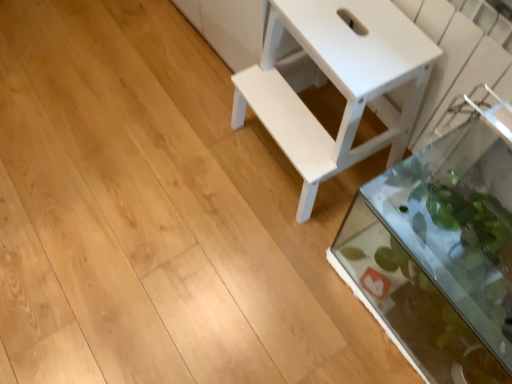
What are the coordinates of `transparent glass tank at lower right` in the screenshot? It's located at (438, 255).

The image size is (512, 384). What do you see at coordinates (438, 255) in the screenshot? I see `transparent glass tank at lower right` at bounding box center [438, 255].

Measure the distance between point (317,121) and camera.

Point (317,121) and camera are 3.92 feet apart.

Describe the element at coordinates (336, 83) in the screenshot. The image size is (512, 384). I see `white matte table at center` at that location.

The width and height of the screenshot is (512, 384). Find the location of `white matte table at center`. white matte table at center is located at coordinates (336, 83).

At what (x,y) coordinates should I click in order to perform the action: click on transparent glass tank at lower right. Please return your answer as a coordinate pair (x, y). The image size is (512, 384). Looking at the image, I should click on (438, 255).

From the picture: Which is more to the right, white matte table at center or transparent glass tank at lower right?

transparent glass tank at lower right is more to the right.

Considering the relative positions of white matte table at center and transparent glass tank at lower right in the image provided, is white matte table at center behind transparent glass tank at lower right?

Yes.

Considering the points (275, 21) and (468, 231), which point is behind, point (275, 21) or point (468, 231)?

Positioned behind is point (275, 21).

From the image's perspective, which one is positioned lower, white matte table at center or transparent glass tank at lower right?

transparent glass tank at lower right is shown below in the image.

From a real-world perspective, does white matte table at center stand above transparent glass tank at lower right?

Yes, from a real-world perspective, white matte table at center is over transparent glass tank at lower right

Can you confirm if white matte table at center is thinner than transparent glass tank at lower right?

No, white matte table at center is not thinner than transparent glass tank at lower right.

Is white matte table at center taller than transparent glass tank at lower right?

Correct, white matte table at center is much taller as transparent glass tank at lower right.

Based on the photo, who is smaller, white matte table at center or transparent glass tank at lower right?

Smaller between the two is white matte table at center.

Do you think white matte table at center is within transparent glass tank at lower right, or outside of it?

white matte table at center is spatially situated outside transparent glass tank at lower right.

Is white matte table at center far from transparent glass tank at lower right?

No, white matte table at center is not far from transparent glass tank at lower right.

Is white matte table at center oriented towards transparent glass tank at lower right?

No.

Consider the image. How many degrees apart are the facing directions of white matte table at center and transparent glass tank at lower right?

The facing directions of white matte table at center and transparent glass tank at lower right are 1.16 degrees apart.

Locate an element on the screen. This screenshot has width=512, height=384. glass box that appears below the white matte table at center (from a real-world perspective) is located at coordinates (438, 255).

Visually, is transparent glass tank at lower right positioned to the left or to the right of white matte table at center?

In the image, transparent glass tank at lower right appears on the right side of white matte table at center.

Based on the photo, is transparent glass tank at lower right positioned before white matte table at center?

Yes.

Considering the points (460, 220) and (273, 113), which point is behind, point (460, 220) or point (273, 113)?

The point (273, 113) is behind.

From the image's perspective, is transparent glass tank at lower right under white matte table at center?

Correct, transparent glass tank at lower right appears lower than white matte table at center in the image.

From a real-world perspective, is transparent glass tank at lower right physically below white matte table at center?

Correct, in the physical world, transparent glass tank at lower right is lower than white matte table at center.

Which of these two, transparent glass tank at lower right or white matte table at center, is wider?

Wider between the two is white matte table at center.

Considering the relative sizes of transparent glass tank at lower right and white matte table at center in the image provided, is transparent glass tank at lower right taller than white matte table at center?

In fact, transparent glass tank at lower right may be shorter than white matte table at center.

Between transparent glass tank at lower right and white matte table at center, which one has larger size?

transparent glass tank at lower right is bigger.

Can we say transparent glass tank at lower right lies outside white matte table at center?

transparent glass tank at lower right lies outside white matte table at center's area.

Would you say transparent glass tank at lower right is a long distance from white matte table at center?

Actually, transparent glass tank at lower right and white matte table at center are a little close together.

Is transparent glass tank at lower right oriented towards white matte table at center?

No, transparent glass tank at lower right is not facing towards white matte table at center.

How different are the orientations of transparent glass tank at lower right and white matte table at center in degrees?

1.16 degrees.

I want to click on glass box below the white matte table at center (from a real-world perspective), so click(x=438, y=255).

What are the coordinates of `glass box in front of the white matte table at center` in the screenshot? It's located at (438, 255).

The height and width of the screenshot is (384, 512). What are the coordinates of `table lying on the left of transparent glass tank at lower right` in the screenshot? It's located at (336, 83).